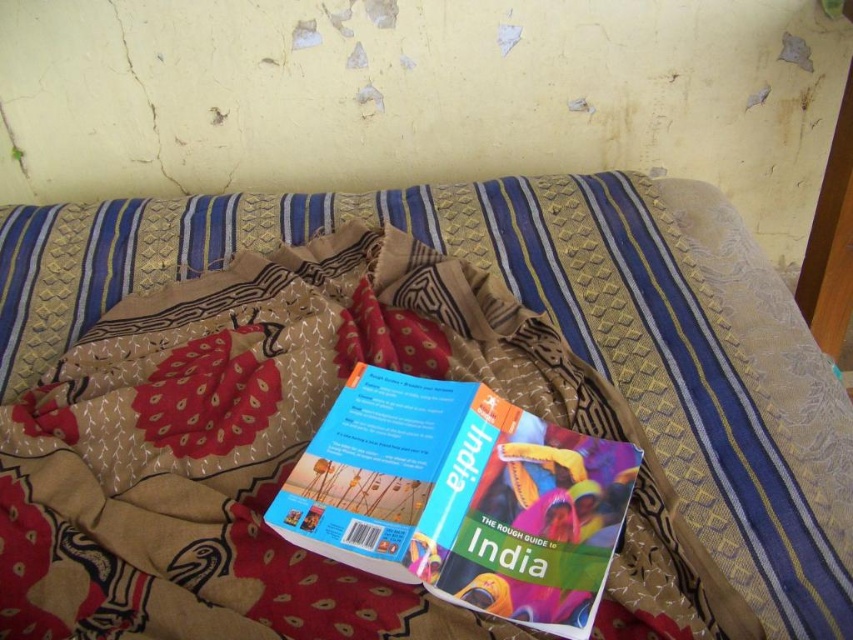
Does textured fabric bed at center have a greater height compared to hardcover book at center?

Correct, textured fabric bed at center is much taller as hardcover book at center.

Can you confirm if textured fabric bed at center is positioned below hardcover book at center?

No.

Does point (631, 396) lie in front of point (345, 540)?

No.

Where is `textured fabric bed at center`? The width and height of the screenshot is (853, 640). textured fabric bed at center is located at coordinates (412, 372).